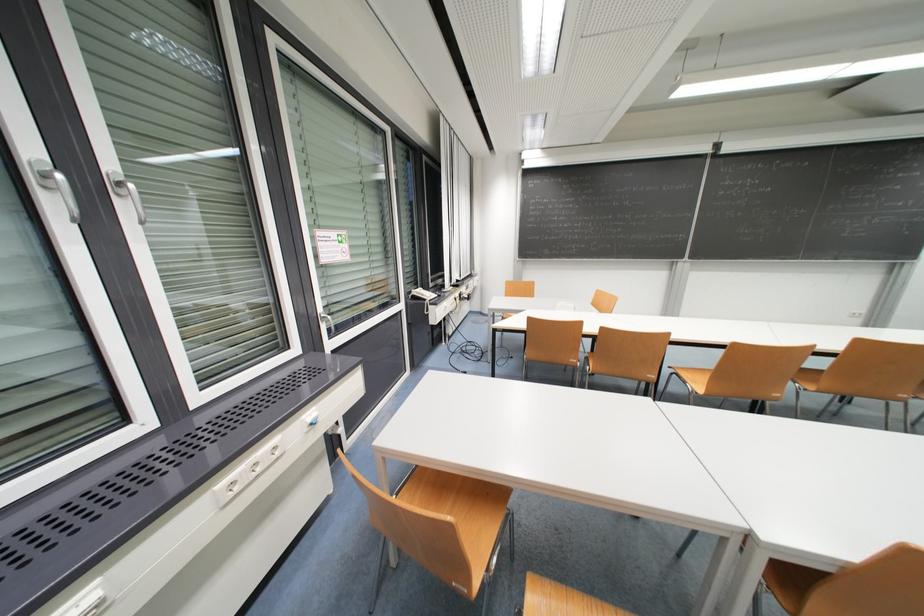
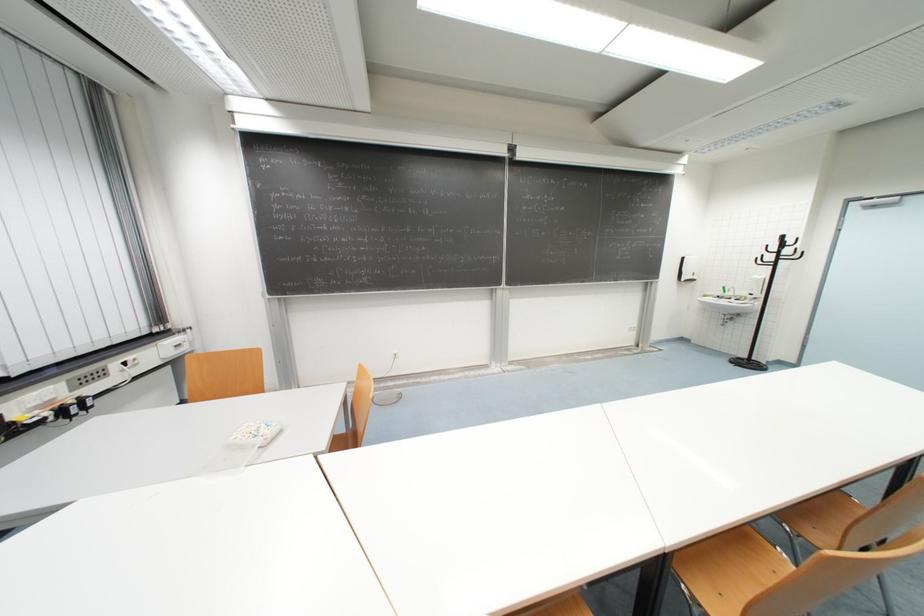
Where in the second image is the point corresponding to point (603, 294) from the first image?

(369, 371)